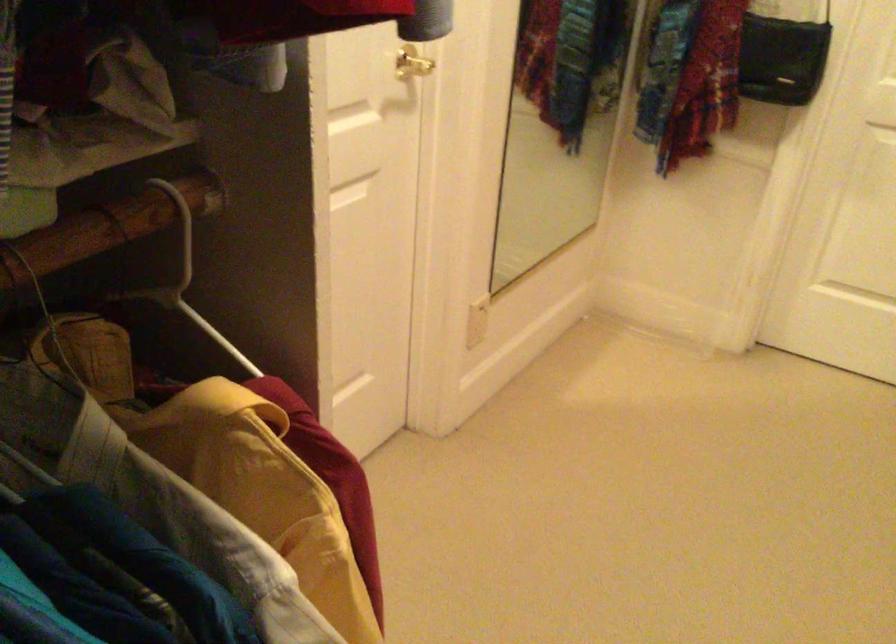
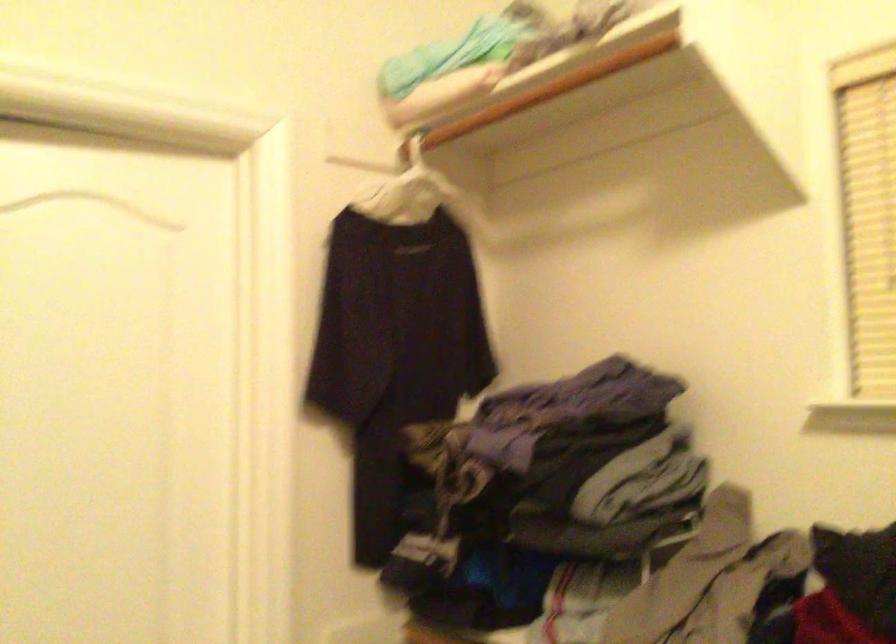
Question: The first image is from the beginning of the video and the second image is from the end. How did the camera likely rotate when shooting the video?

Choices:
 (A) Left
 (B) Right
 (C) Up
 (D) Down

Answer: (B)